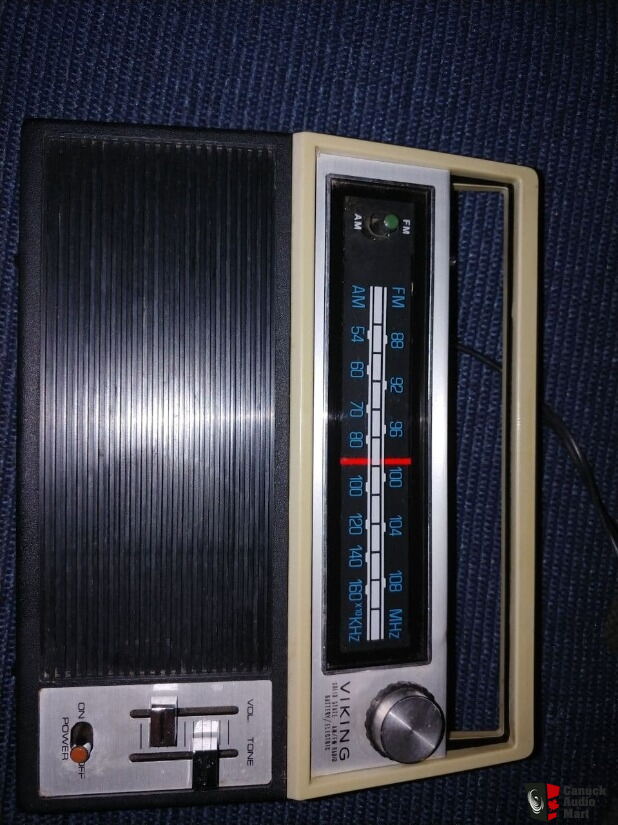
Where is `portable radio`? The height and width of the screenshot is (825, 618). portable radio is located at coordinates (298, 451).